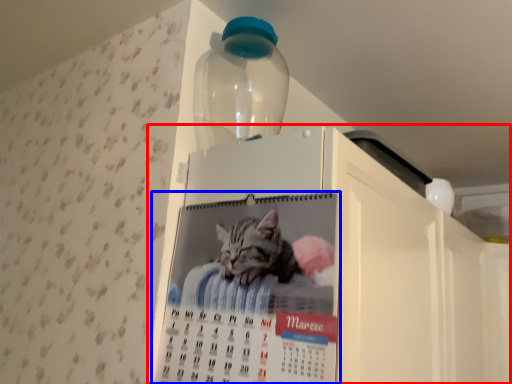
Question: Which object appears farthest to the camera in this image, appliance (highlighted by a red box) or poster (highlighted by a blue box)?

Choices:
 (A) appliance
 (B) poster

Answer: (B)